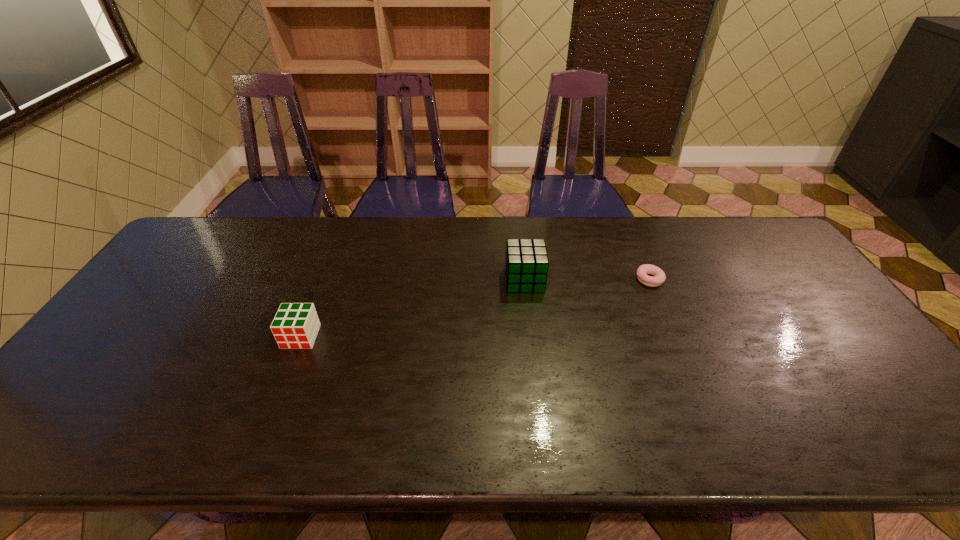
This screenshot has width=960, height=540. In the image, there is a desktop. Identify the location of blank space at the near edge. (506, 430).

I want to click on vacant space at the left edge of the desktop, so click(x=185, y=259).

This screenshot has height=540, width=960. I want to click on vacant region at the right edge of the desktop, so click(824, 299).

You are a GUI agent. You are given a task and a screenshot of the screen. Output one action in this format:
    pyautogui.click(x=<x>, y=<y>)
    Task: Click on the free space between the tallest object and the second tallest object
    
    Given the screenshot: What is the action you would take?
    pyautogui.click(x=413, y=308)

Where is `vacant space that is in between the doughnut and the tallest object`? vacant space that is in between the doughnut and the tallest object is located at coordinates (587, 280).

Find the location of a particular element. free area in between the leftmost object and the right cube is located at coordinates (413, 308).

This screenshot has height=540, width=960. Find the location of `free space between the right cube and the second tallest object`. free space between the right cube and the second tallest object is located at coordinates (413, 308).

You are a GUI agent. You are given a task and a screenshot of the screen. Output one action in this format:
    pyautogui.click(x=<x>, y=<y>)
    Task: Click on the free space between the taller cube and the shortest object
    
    Given the screenshot: What is the action you would take?
    pyautogui.click(x=587, y=280)

What are the coordinates of `free space between the tallest object and the doughnut` in the screenshot? It's located at (587, 280).

I want to click on vacant area that lies between the shorter cube and the doughnut, so click(475, 308).